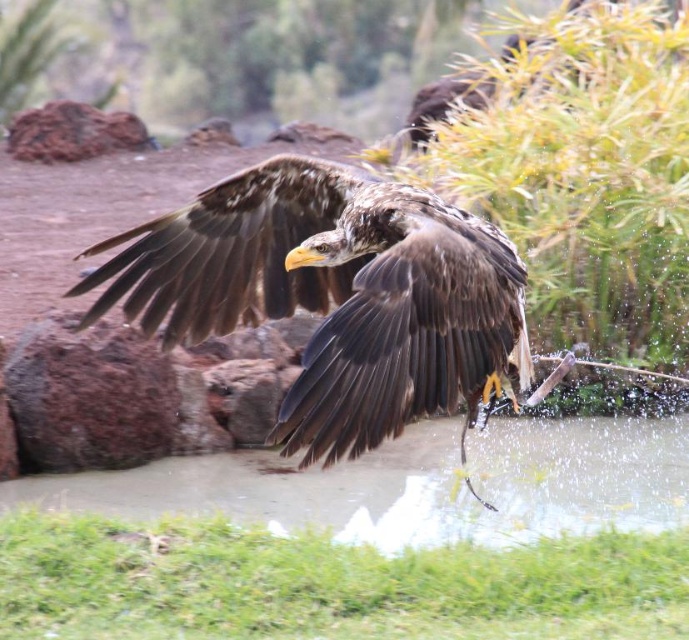
Does brown feathered eagle at center appear over clear water at lower center?

Yes.

Does brown feathered eagle at center have a smaller size compared to clear water at lower center?

Correct, brown feathered eagle at center occupies less space than clear water at lower center.

Is point (320, 275) farther from viewer compared to point (384, 451)?

No, it is not.

What are the coordinates of `brown feathered eagle at center` in the screenshot? It's located at (333, 294).